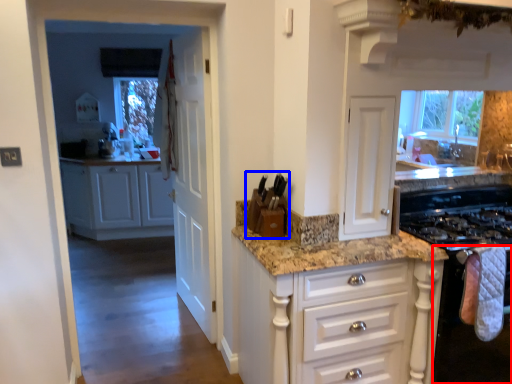
Question: Which object appears farthest to the camera in this image, oven (highlighted by a red box) or appliance (highlighted by a blue box)?

Choices:
 (A) oven
 (B) appliance

Answer: (B)